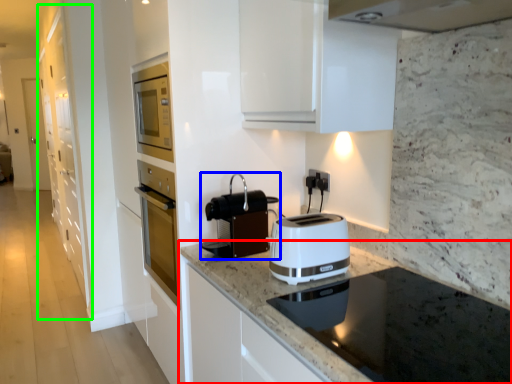
Question: Which is farther away from countertop (highlighted by a red box)? kitchen appliance (highlighted by a blue box) or cabinetry (highlighted by a green box)?

Choices:
 (A) kitchen appliance
 (B) cabinetry

Answer: (B)